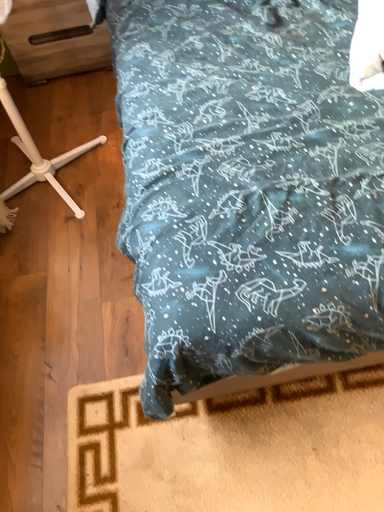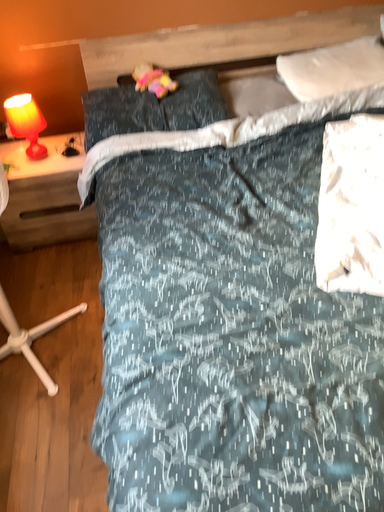
Question: Which way did the camera rotate in the video?

Choices:
 (A) rotated upward
 (B) rotated downward

Answer: (A)